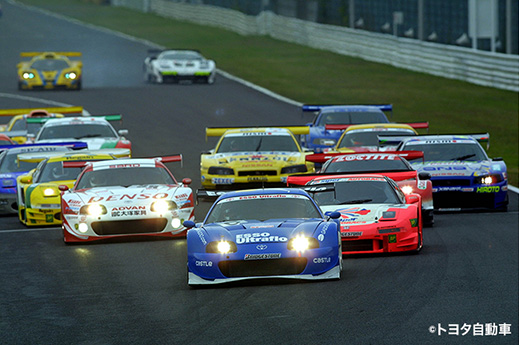
Identify the location of hoods. (129, 197), (266, 161), (266, 234), (368, 216), (463, 170), (185, 68), (52, 73), (101, 143), (10, 181), (36, 190).